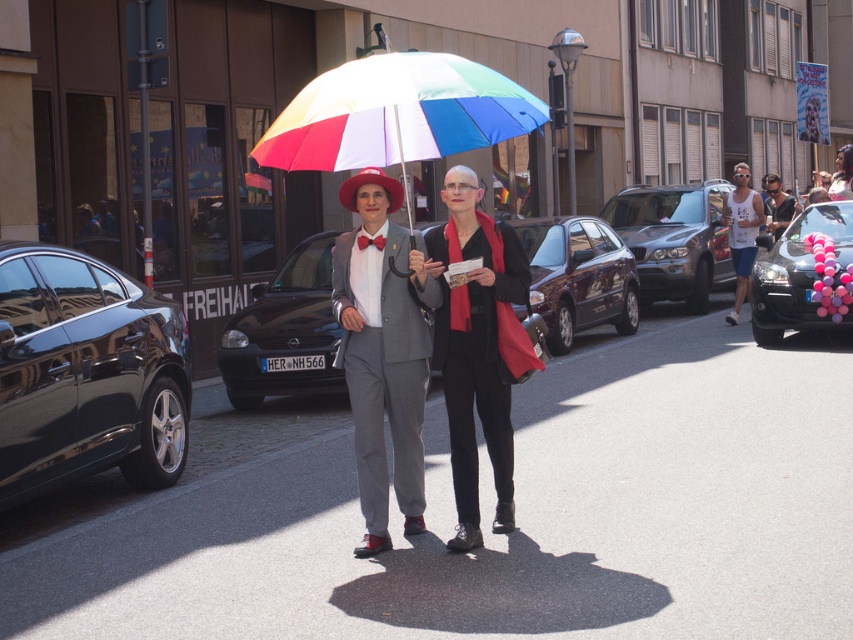
Between shiny dark brown hatchback at center and pink balloon-decorated car at right, which one appears on the right side from the viewer's perspective?

From the viewer's perspective, pink balloon-decorated car at right appears more on the right side.

Is shiny dark brown hatchback at center below pink balloon-decorated car at right?

Indeed, shiny dark brown hatchback at center is positioned under pink balloon-decorated car at right.

Between point (634, 321) and point (798, 266), which one is positioned behind?

The point (634, 321) is behind.

The width and height of the screenshot is (853, 640). Identify the location of shiny dark brown hatchback at center. (578, 276).

Is pink balloon-decorated car at right wider than matte black tank top at center?

Correct, the width of pink balloon-decorated car at right exceeds that of matte black tank top at center.

Does point (851, 259) lie behind point (788, 212)?

No, (851, 259) is in front of (788, 212).

Image resolution: width=853 pixels, height=640 pixels. What do you see at coordinates (795, 273) in the screenshot? I see `pink balloon-decorated car at right` at bounding box center [795, 273].

Find the location of a particular element. The image size is (853, 640). pink balloon-decorated car at right is located at coordinates (795, 273).

Is matte gray suit at center further to camera compared to white tank top at center?

No, matte gray suit at center is in front of white tank top at center.

Which is behind, point (335, 358) or point (759, 220)?

Positioned behind is point (759, 220).

Which is in front, point (361, 388) or point (729, 323)?

Point (361, 388) is more forward.

This screenshot has height=640, width=853. I want to click on matte gray suit at center, so click(383, 349).